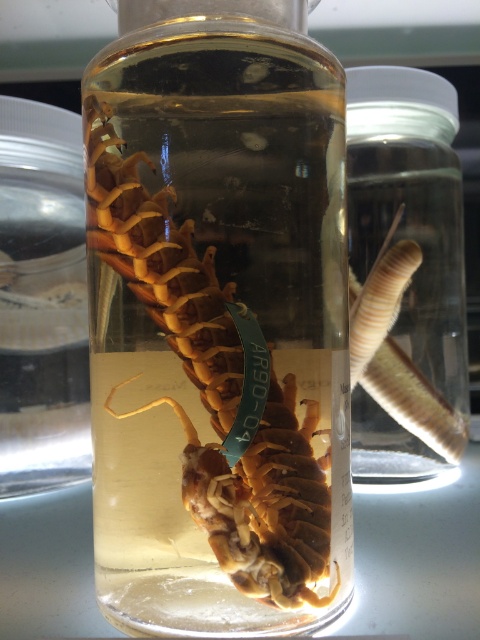
Question: Can you confirm if brown matte centipede at center is positioned below translucent glass worm at right?

Choices:
 (A) no
 (B) yes

Answer: (B)

Question: Can you confirm if brown matte centipede at center is positioned to the right of translucent glass worm at right?

Choices:
 (A) no
 (B) yes

Answer: (A)

Question: Can you confirm if brown matte centipede at center is wider than translucent glass worm at right?

Choices:
 (A) no
 (B) yes

Answer: (A)

Question: Which of the following is the closest to the observer?

Choices:
 (A) brown matte centipede at center
 (B) translucent glass worm at right

Answer: (A)

Question: Which point appears closest to the camera in this image?

Choices:
 (A) (257, 474)
 (B) (380, 236)

Answer: (A)